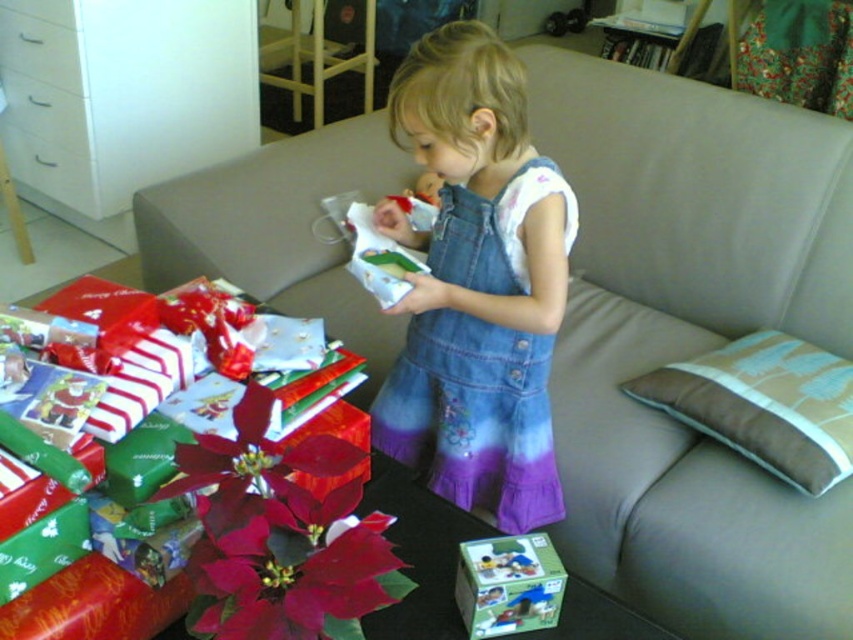
Who is more distant from viewer, (x=508, y=212) or (x=492, y=618)?

Point (x=508, y=212)

Between denim dress at center and green cardboard box at lower center, which one appears on the left side from the viewer's perspective?

From the viewer's perspective, denim dress at center appears more on the left side.

Identify the location of denim dress at center. The height and width of the screenshot is (640, 853). (473, 417).

Locate an element on the screen. The height and width of the screenshot is (640, 853). denim dress at center is located at coordinates (473, 417).